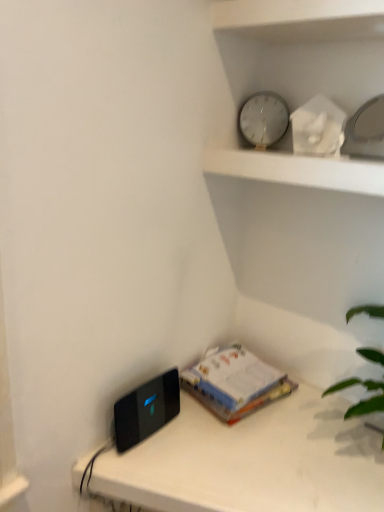
Question: Is black glossy ipod at lower left bigger or smaller than white glass clock at upper center?

Choices:
 (A) small
 (B) big

Answer: (A)

Question: In the image, is black glossy ipod at lower left on the left side or the right side of white glass clock at upper center?

Choices:
 (A) left
 (B) right

Answer: (A)

Question: Estimate the real-world distances between objects in this image. Which object is closer to the white glass clock at upper center?

Choices:
 (A) metallic clock at upper center
 (B) white paper at center
 (C) black plastic device at lower left
 (D) black glossy ipod at lower left

Answer: (A)

Question: Estimate the real-world distances between objects in this image. Which object is farther from the black glossy ipod at lower left?

Choices:
 (A) black plastic device at lower left
 (B) white glass clock at upper center
 (C) white paper at center
 (D) metallic clock at upper center

Answer: (B)